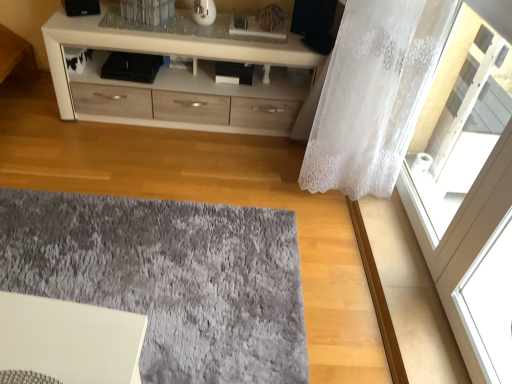
Question: Is white lace curtain at right oriented towards gray shaggy rug at center?

Choices:
 (A) yes
 (B) no

Answer: (B)

Question: Is white lace curtain at right at the left side of gray shaggy rug at center?

Choices:
 (A) yes
 (B) no

Answer: (B)

Question: Does white lace curtain at right have a lesser height compared to gray shaggy rug at center?

Choices:
 (A) yes
 (B) no

Answer: (B)

Question: Would you say white lace curtain at right contains gray shaggy rug at center?

Choices:
 (A) yes
 (B) no

Answer: (B)

Question: Is white lace curtain at right smaller than gray shaggy rug at center?

Choices:
 (A) no
 (B) yes

Answer: (A)

Question: Are white lace curtain at right and gray shaggy rug at center far apart?

Choices:
 (A) no
 (B) yes

Answer: (A)

Question: Is white glossy cabinet at upper center smaller than white lace curtain at right?

Choices:
 (A) yes
 (B) no

Answer: (B)

Question: Does white glossy cabinet at upper center have a lesser height compared to white lace curtain at right?

Choices:
 (A) no
 (B) yes

Answer: (B)

Question: Is white glossy cabinet at upper center directly adjacent to white lace curtain at right?

Choices:
 (A) no
 (B) yes

Answer: (A)

Question: From a real-world perspective, is white glossy cabinet at upper center on top of white lace curtain at right?

Choices:
 (A) yes
 (B) no

Answer: (B)

Question: Considering the relative sizes of white glossy cabinet at upper center and white lace curtain at right in the image provided, is white glossy cabinet at upper center thinner than white lace curtain at right?

Choices:
 (A) no
 (B) yes

Answer: (B)

Question: From the image's perspective, is white glossy cabinet at upper center on top of white lace curtain at right?

Choices:
 (A) yes
 (B) no

Answer: (A)

Question: From a real-world perspective, is white lace curtain at right positioned under white glossy cabinet at upper center based on gravity?

Choices:
 (A) yes
 (B) no

Answer: (B)